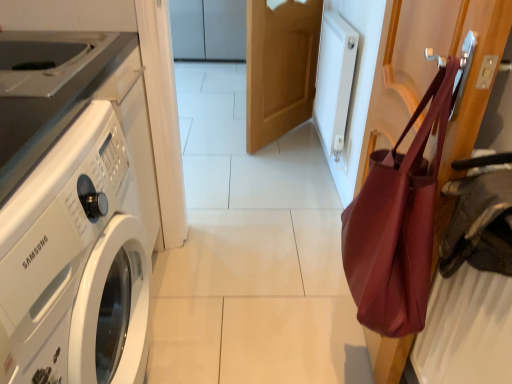
Question: Are matte burgundy tote bag at right and white glossy washing machine at left located far from each other?

Choices:
 (A) no
 (B) yes

Answer: (A)

Question: Is matte burgundy tote bag at right turned away from white glossy washing machine at left?

Choices:
 (A) no
 (B) yes

Answer: (A)

Question: Does matte burgundy tote bag at right have a greater height compared to white glossy washing machine at left?

Choices:
 (A) no
 (B) yes

Answer: (A)

Question: Considering the relative sizes of matte burgundy tote bag at right and white glossy washing machine at left in the image provided, is matte burgundy tote bag at right shorter than white glossy washing machine at left?

Choices:
 (A) yes
 (B) no

Answer: (A)

Question: Is matte burgundy tote bag at right facing towards white glossy washing machine at left?

Choices:
 (A) no
 (B) yes

Answer: (B)

Question: Based on their sizes in the image, would you say matte burgundy tote bag at right is bigger or smaller than white glossy washing machine at left?

Choices:
 (A) big
 (B) small

Answer: (B)

Question: From their relative heights in the image, would you say matte burgundy tote bag at right is taller or shorter than white glossy washing machine at left?

Choices:
 (A) tall
 (B) short

Answer: (B)

Question: Is matte burgundy tote bag at right in front of or behind white glossy washing machine at left in the image?

Choices:
 (A) front
 (B) behind

Answer: (B)

Question: Considering the relative positions of matte burgundy tote bag at right and white glossy washing machine at left in the image provided, is matte burgundy tote bag at right to the left or to the right of white glossy washing machine at left?

Choices:
 (A) left
 (B) right

Answer: (B)

Question: From a real-world perspective, is white glossy washing machine at left physically located above or below matte burgundy tote bag at right?

Choices:
 (A) above
 (B) below

Answer: (B)

Question: From the image's perspective, is white glossy washing machine at left located above or below matte burgundy tote bag at right?

Choices:
 (A) below
 (B) above

Answer: (A)

Question: Considering the relative positions of white glossy washing machine at left and matte burgundy tote bag at right in the image provided, is white glossy washing machine at left to the left or to the right of matte burgundy tote bag at right?

Choices:
 (A) right
 (B) left

Answer: (B)

Question: Relative to matte burgundy tote bag at right, is white glossy washing machine at left in front or behind?

Choices:
 (A) front
 (B) behind

Answer: (A)

Question: Considering the positions of point pos(300,16) and point pos(108,109), is point pos(300,16) closer or farther from the camera than point pos(108,109)?

Choices:
 (A) farther
 (B) closer

Answer: (A)

Question: Considering the positions of light brown wood door at center and white glossy washing machine at left in the image, is light brown wood door at center bigger or smaller than white glossy washing machine at left?

Choices:
 (A) big
 (B) small

Answer: (B)